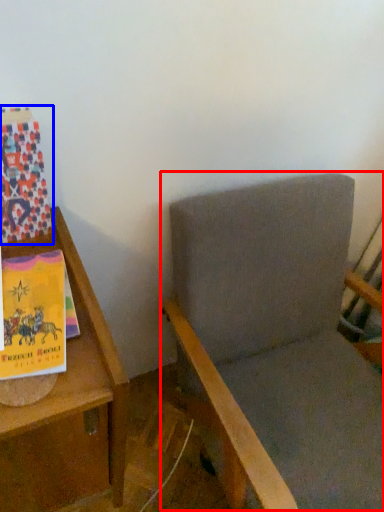
Question: Which object appears closest to the camera in this image, rocking chair (highlighted by a red box) or paperback book (highlighted by a blue box)?

Choices:
 (A) rocking chair
 (B) paperback book

Answer: (A)